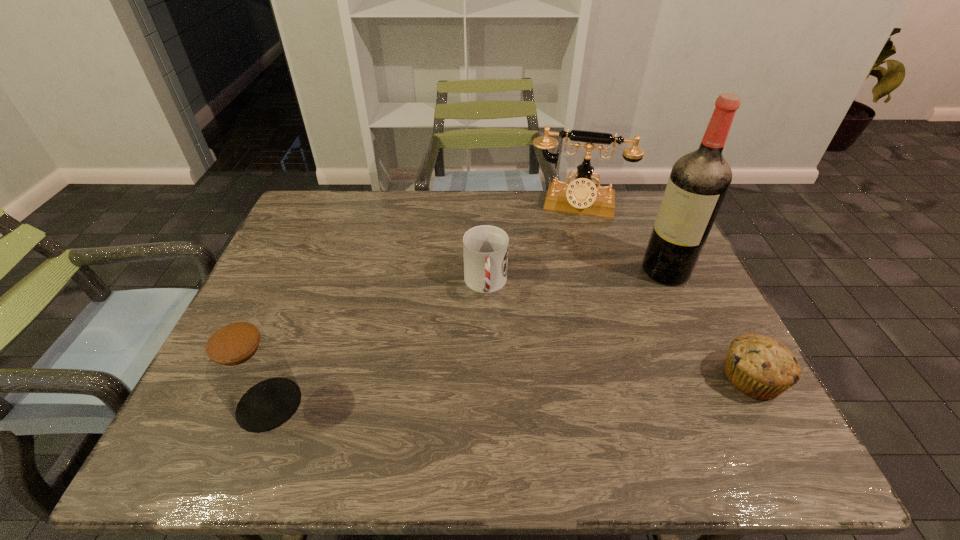
Where is `free space at the near edge of the desktop`? free space at the near edge of the desktop is located at coordinates (505, 379).

The image size is (960, 540). I want to click on vacant space at the right edge, so click(719, 316).

I want to click on vacant space at the far left corner of the desktop, so click(310, 205).

The image size is (960, 540). I want to click on free spot at the far right corner of the desktop, so click(x=619, y=197).

You are a GUI agent. You are given a task and a screenshot of the screen. Output one action in this format:
    pyautogui.click(x=<x>, y=<y>)
    Task: Click on the free space between the telephone and the cup
    The width and height of the screenshot is (960, 540).
    Given the screenshot: What is the action you would take?
    pyautogui.click(x=532, y=244)

This screenshot has height=540, width=960. Find the location of `vacant area that lies between the second tallest object and the tallest object`. vacant area that lies between the second tallest object and the tallest object is located at coordinates (621, 238).

You are a GUI agent. You are given a task and a screenshot of the screen. Output one action in this format:
    pyautogui.click(x=<x>, y=<y>)
    Task: Click on the unoccupied area between the leftmost object and the muffin
    
    Given the screenshot: What is the action you would take?
    pyautogui.click(x=511, y=391)

Where is `free space between the jar and the muffin`? The image size is (960, 540). free space between the jar and the muffin is located at coordinates (511, 391).

You are a GUI agent. You are given a task and a screenshot of the screen. Output one action in this format:
    pyautogui.click(x=<x>, y=<y>)
    Task: Click on the unoccupied position between the farthest object and the tallest object
    The image size is (960, 540).
    Given the screenshot: What is the action you would take?
    pyautogui.click(x=621, y=238)

Identify the location of free space that is in between the shortest object and the jar. The image size is (960, 540). (511, 391).